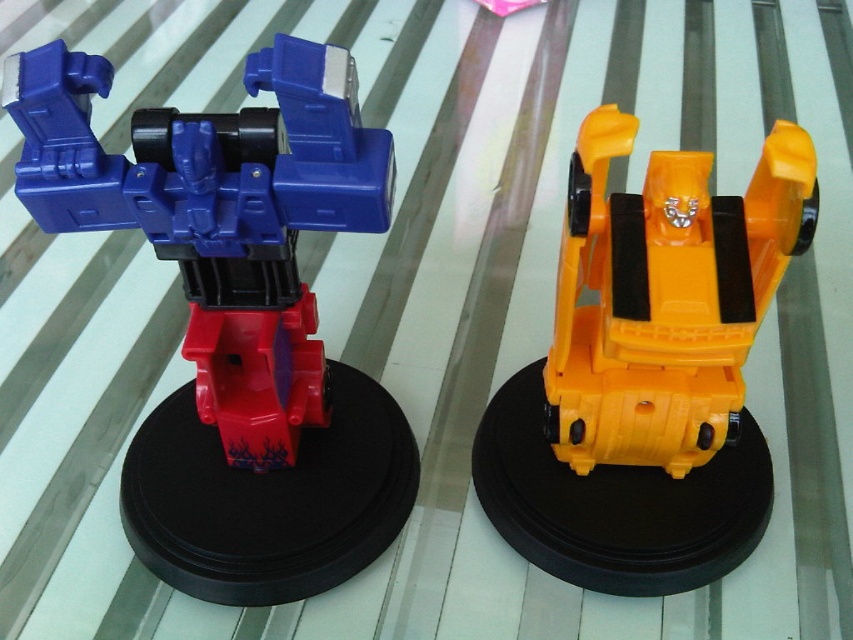
Question: Can you confirm if orange matte plastic robot at center is positioned to the left of matte plastic transformer at left?

Choices:
 (A) no
 (B) yes

Answer: (A)

Question: Does orange matte plastic robot at center have a greater width compared to matte plastic transformer at left?

Choices:
 (A) yes
 (B) no

Answer: (A)

Question: Which object appears closest to the camera in this image?

Choices:
 (A) orange matte plastic robot at center
 (B) matte plastic transformer at left

Answer: (B)

Question: Does orange matte plastic robot at center lie in front of matte plastic transformer at left?

Choices:
 (A) yes
 (B) no

Answer: (B)